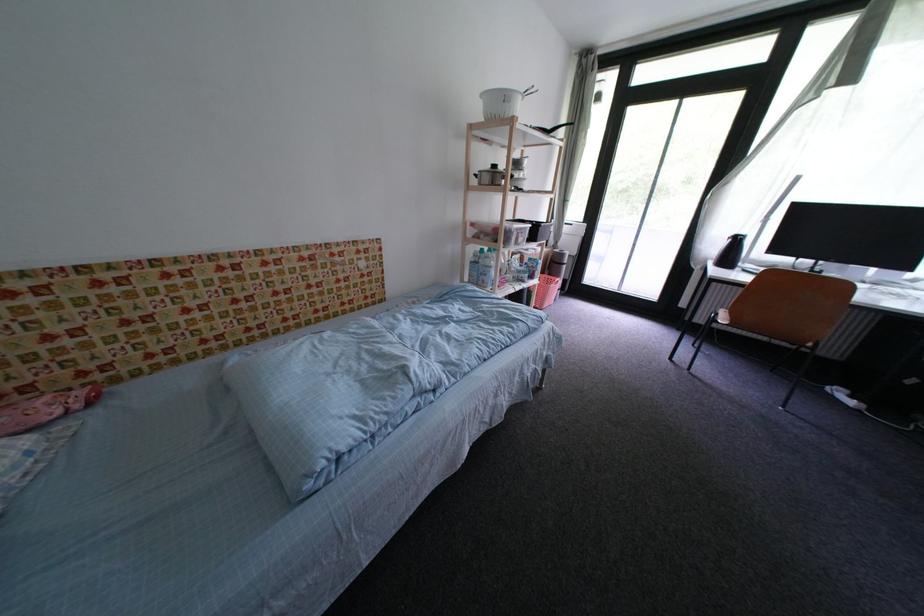
What are the coordinates of `black pan handle` in the screenshot? It's located at (561, 126).